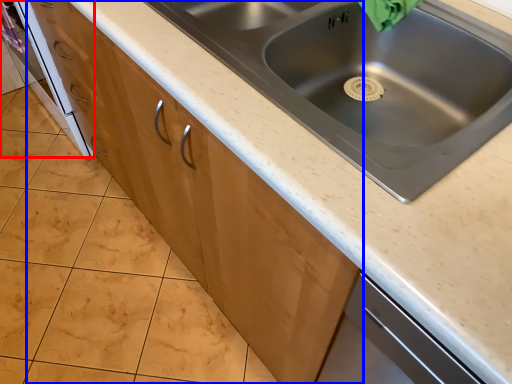
Question: Which of the following is the closest to the observer, oven (highlighted by a red box) or cabinetry (highlighted by a blue box)?

Choices:
 (A) oven
 (B) cabinetry

Answer: (B)